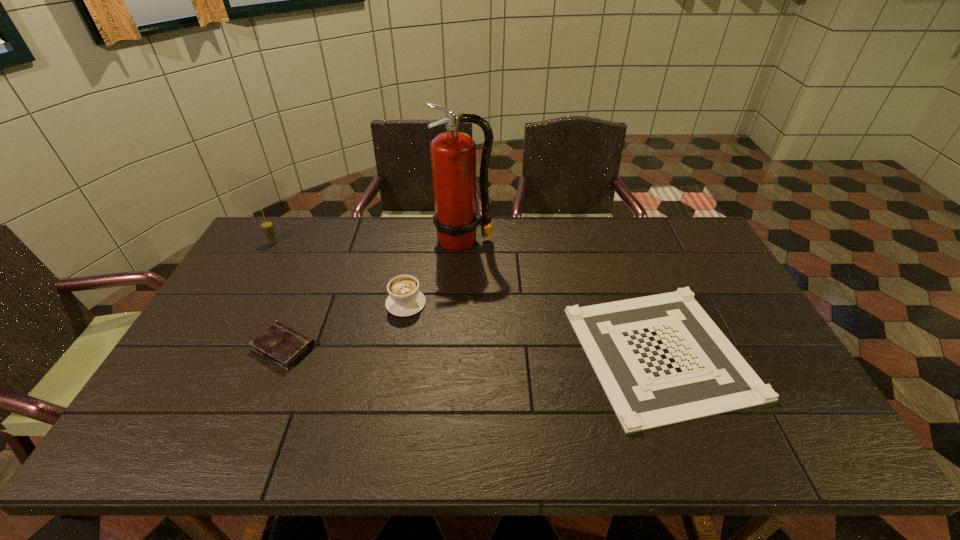
The height and width of the screenshot is (540, 960). Find the location of `free spot at the near right corner of the desktop`. free spot at the near right corner of the desktop is located at coordinates [823, 448].

Identify the location of empty location between the leftmost object and the rightmost object. The width and height of the screenshot is (960, 540). (467, 297).

This screenshot has height=540, width=960. What are the coordinates of `empty space that is in between the rightmost object and the fourth shortest object` in the screenshot? It's located at (467, 297).

At what (x,y) coordinates should I click in order to perform the action: click on blank region between the fourth object from right to left and the fourth shortest object. Please return your answer as a coordinate pair (x, y). The width and height of the screenshot is (960, 540). Looking at the image, I should click on (278, 295).

At what (x,y) coordinates should I click in order to perform the action: click on blank region between the checkerboard and the fire extinguisher. Please return your answer as a coordinate pair (x, y). This screenshot has width=960, height=540. Looking at the image, I should click on (563, 296).

At what (x,y) coordinates should I click in order to perform the action: click on unoccupied position between the second object from left to right and the tallest object. Please return your answer as a coordinate pair (x, y). Image resolution: width=960 pixels, height=540 pixels. Looking at the image, I should click on (373, 294).

Locate an element on the screen. The width and height of the screenshot is (960, 540). vacant space that's between the third object from right to left and the shortest object is located at coordinates (534, 327).

Identify the location of vacant area that lies between the diary and the tallest object. The image size is (960, 540). (373, 294).

Locate an element on the screen. free area in between the tallest object and the cappuccino is located at coordinates (435, 272).

This screenshot has height=540, width=960. I want to click on vacant space in between the fourth tallest object and the fourth shortest object, so click(278, 295).